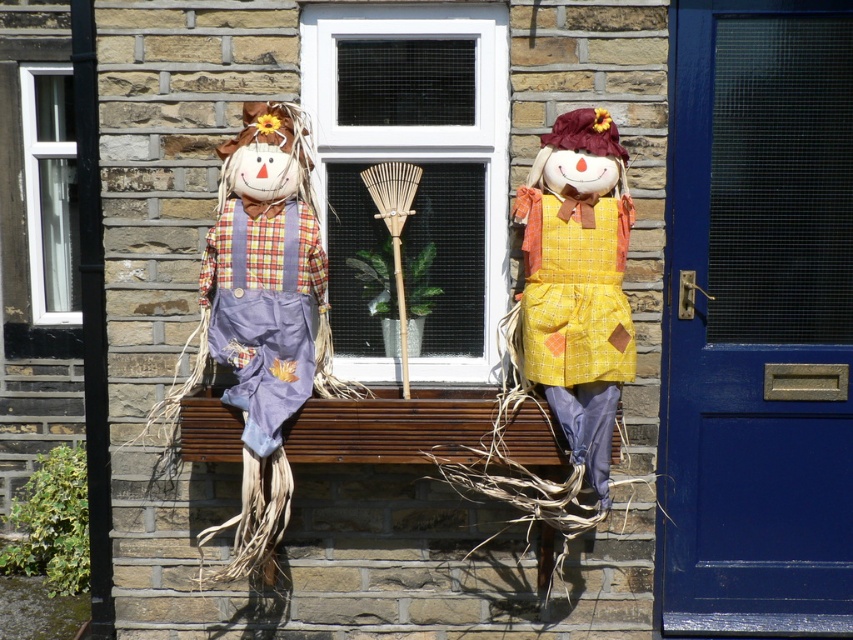
Which of these two, yellow fabric doll at center or white plastic window at left, stands shorter?

Standing shorter between the two is white plastic window at left.

Can you confirm if yellow fabric doll at center is thinner than white plastic window at left?

No, yellow fabric doll at center is not thinner than white plastic window at left.

The width and height of the screenshot is (853, 640). What do you see at coordinates (577, 282) in the screenshot?
I see `yellow fabric doll at center` at bounding box center [577, 282].

You are a GUI agent. You are given a task and a screenshot of the screen. Output one action in this format:
    pyautogui.click(x=<x>, y=<y>)
    Task: Click on the yellow fabric doll at center
    The height and width of the screenshot is (640, 853).
    Given the screenshot: What is the action you would take?
    pyautogui.click(x=577, y=282)

Can you confirm if matte purple overalls at left is positioned below wooden bench at center?

Incorrect, matte purple overalls at left is not positioned below wooden bench at center.

Measure the distance between point [291,384] and camera.

They are 4.18 meters apart.

Between point (274, 481) and point (564, 456), which one is positioned behind?

The point (274, 481) is more distant.

Where is `matte purple overalls at left`? The width and height of the screenshot is (853, 640). matte purple overalls at left is located at coordinates (265, 314).

Between matte purple overalls at left and white plastic window at left, which one is positioned higher?

white plastic window at left is higher up.

Image resolution: width=853 pixels, height=640 pixels. What do you see at coordinates (265, 314) in the screenshot?
I see `matte purple overalls at left` at bounding box center [265, 314].

The width and height of the screenshot is (853, 640). I want to click on matte purple overalls at left, so click(265, 314).